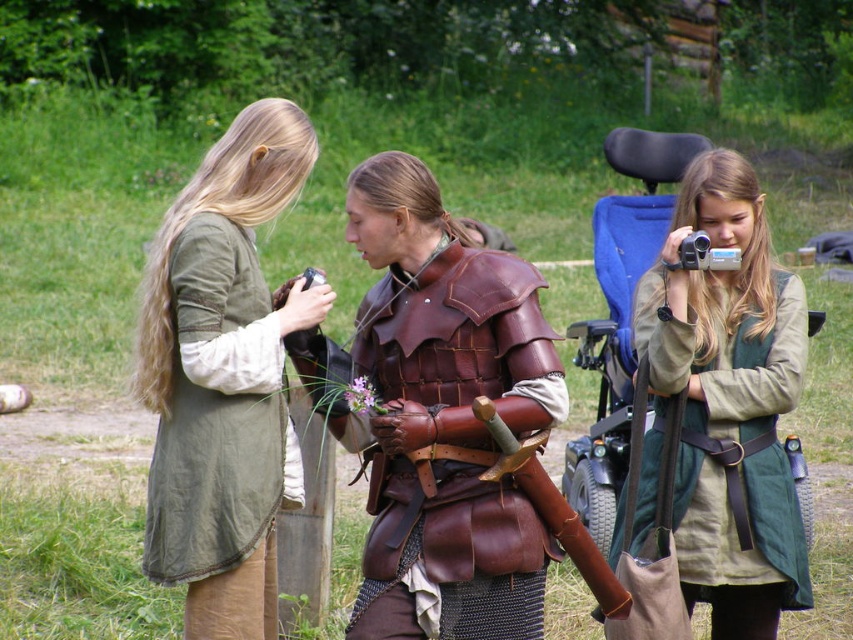
From the picture: You are a guest at the medieval event and notice two costumes. The green linen tunic at left and the leather armor at center. Which costume is positioned higher from the ground?

The green linen tunic at left is above the leather armor at center, so the green linen tunic at left is positioned higher from the ground.